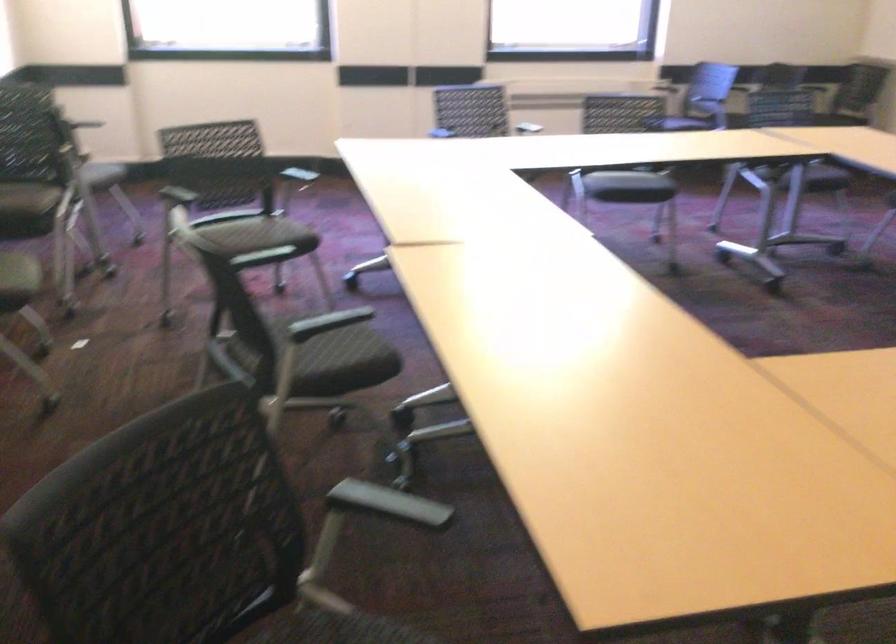
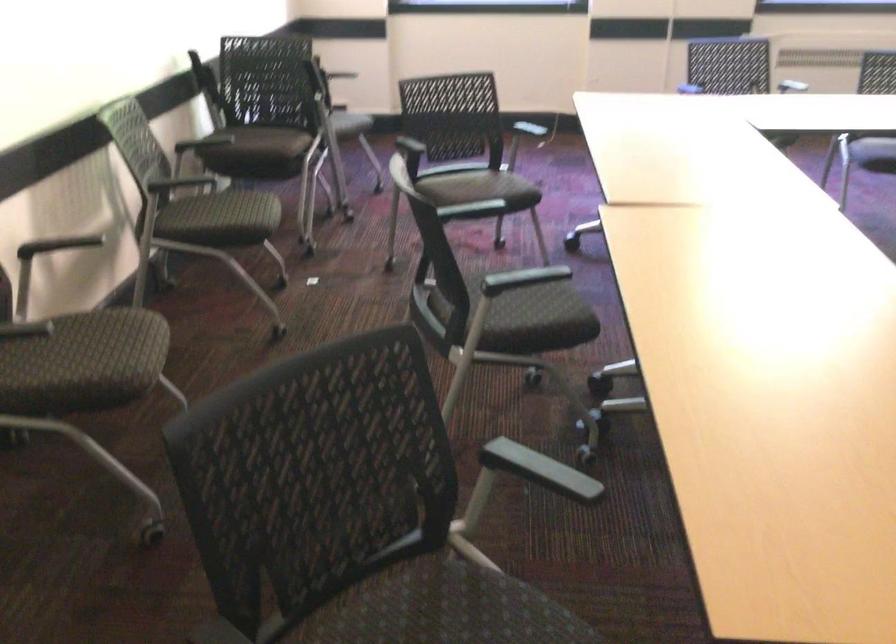
In the second image, find the point that corresponds to (x=259, y=237) in the first image.

(479, 189)